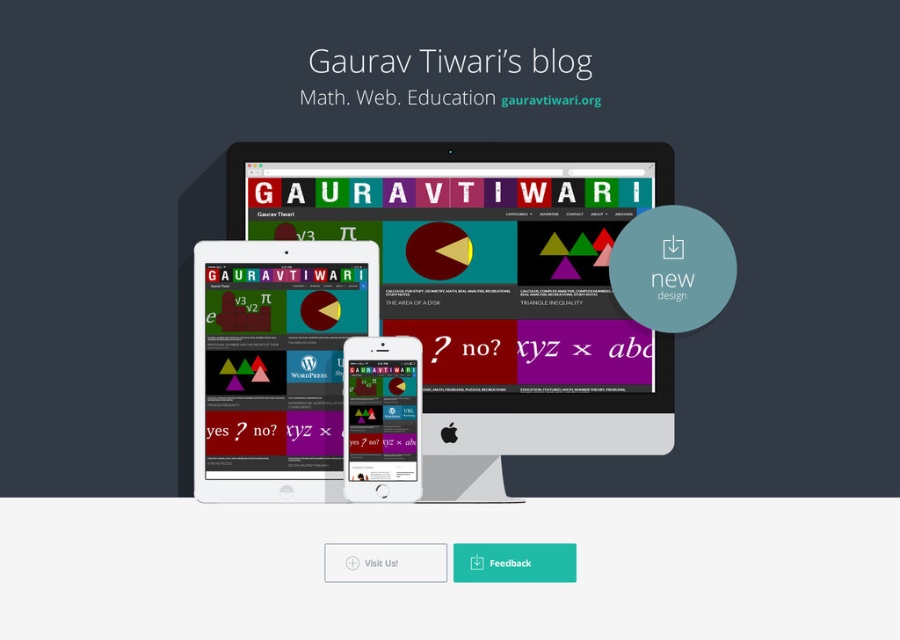
You are standing in front of the promotional graphic for Gaurav Tiwari blog. You see two points, point (561, 333) and point (416, 460). Which point is closer to you?

Point (561, 333) is further to the viewer than point (416, 460), so point (416, 460) is closer to you.

From the picture: You are looking at the promotional graphic for Gaurav Tiwari blog. You see a satin silver monitor at center and a matte white tablet at center. Which device is positioned to the right side?

The satin silver monitor at center is positioned to the right of the matte white tablet at center.